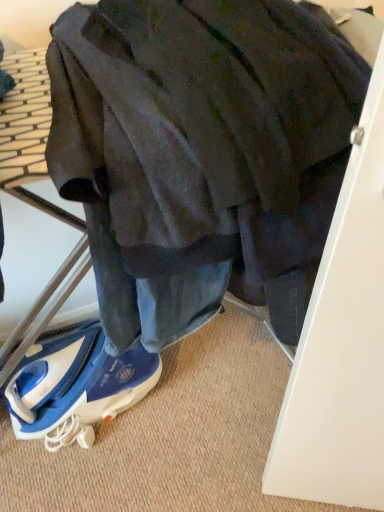
Question: From the image's perspective, is dark corduroy jacket at center located above or below blue fabric shoe at lower center?

Choices:
 (A) below
 (B) above

Answer: (B)

Question: Looking at their shapes, would you say dark corduroy jacket at center is wider or thinner than blue fabric shoe at lower center?

Choices:
 (A) thin
 (B) wide

Answer: (B)

Question: From a real-world perspective, is dark corduroy jacket at center physically located above or below blue fabric shoe at lower center?

Choices:
 (A) below
 (B) above

Answer: (B)

Question: From a real-world perspective, is blue fabric shoe at lower center physically located above or below dark corduroy jacket at center?

Choices:
 (A) above
 (B) below

Answer: (B)

Question: Is blue fabric shoe at lower center taller or shorter than dark corduroy jacket at center?

Choices:
 (A) tall
 (B) short

Answer: (B)

Question: In the image, is blue fabric shoe at lower center positioned in front of or behind dark corduroy jacket at center?

Choices:
 (A) behind
 (B) front

Answer: (A)

Question: Is blue fabric shoe at lower center bigger or smaller than dark corduroy jacket at center?

Choices:
 (A) small
 (B) big

Answer: (A)